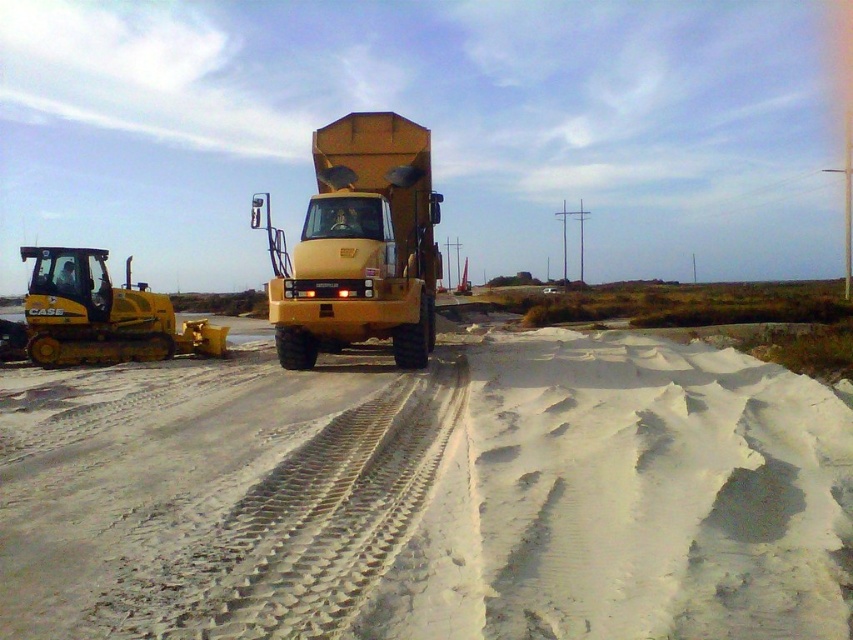
Is point (379, 300) positioned before point (213, 353)?

Yes, point (379, 300) is closer to viewer.

Is yellow matte dump truck at center taller than yellow rubber plow at left?

Yes, yellow matte dump truck at center is taller than yellow rubber plow at left.

Does point (404, 280) come farther from viewer compared to point (32, 282)?

No.

Where is `yellow matte dump truck at center`? yellow matte dump truck at center is located at coordinates coord(358,244).